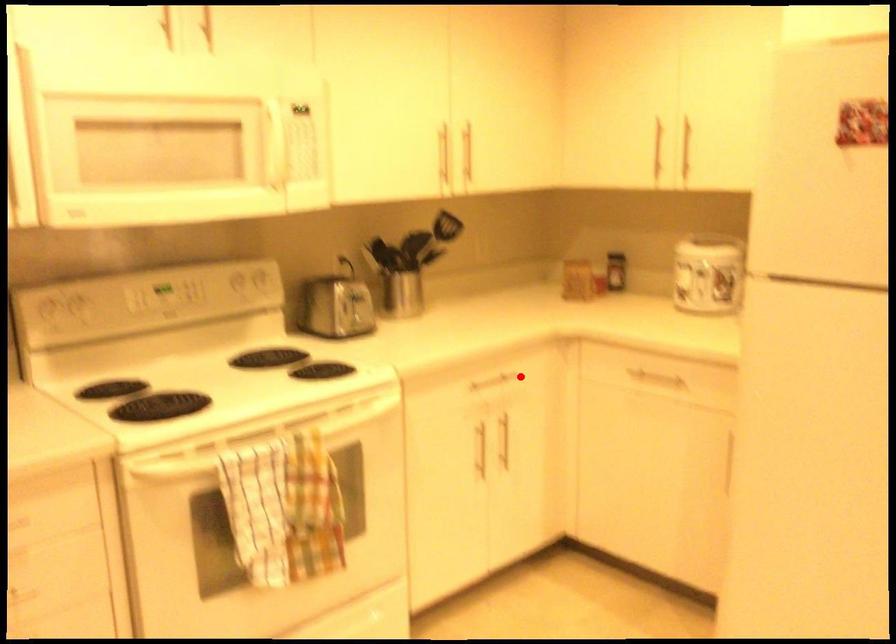
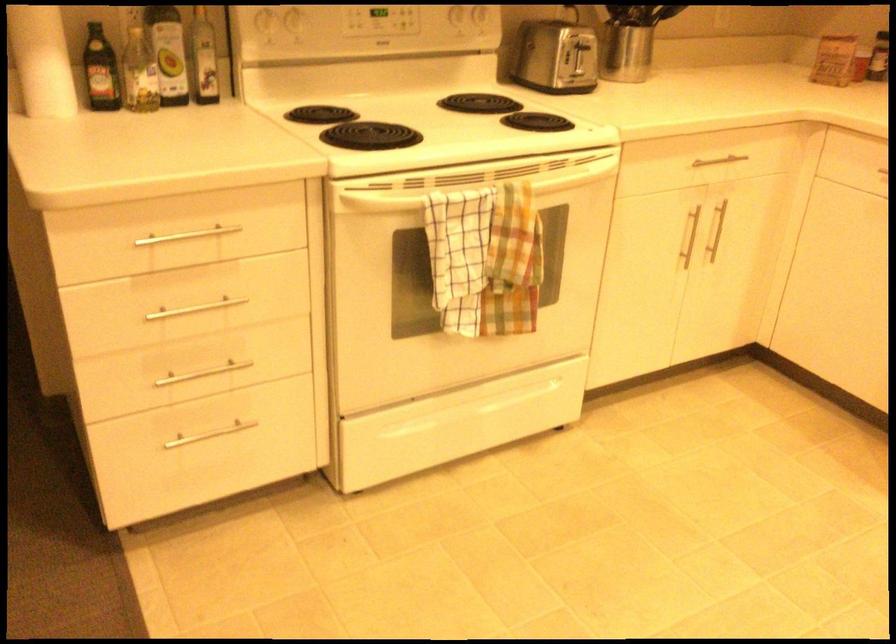
Question: I am providing you with two images of the same scene from different viewpoints. A red point is marked on the first image. At the location where the point appears in image 1, is it still visible in image 2?

Choices:
 (A) Yes
 (B) No

Answer: (A)